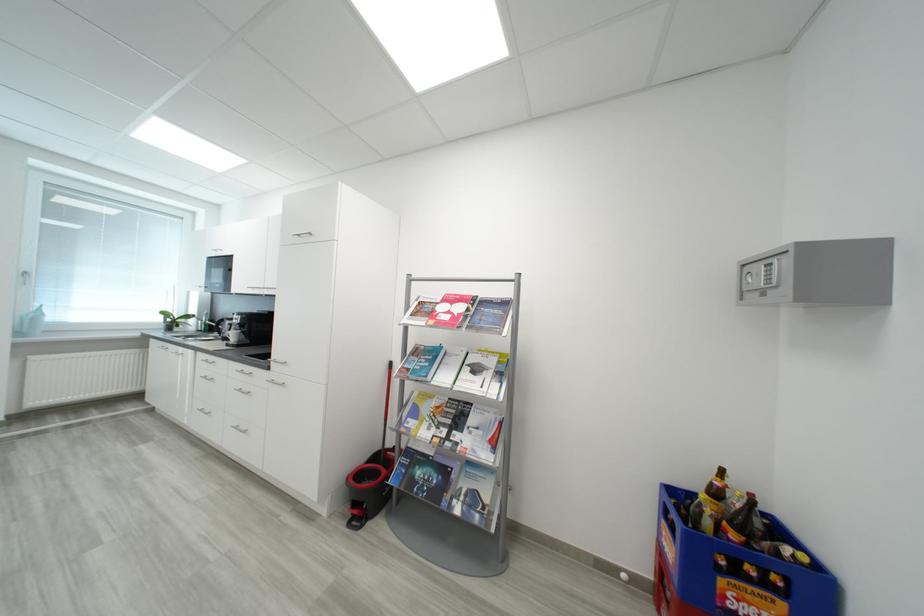
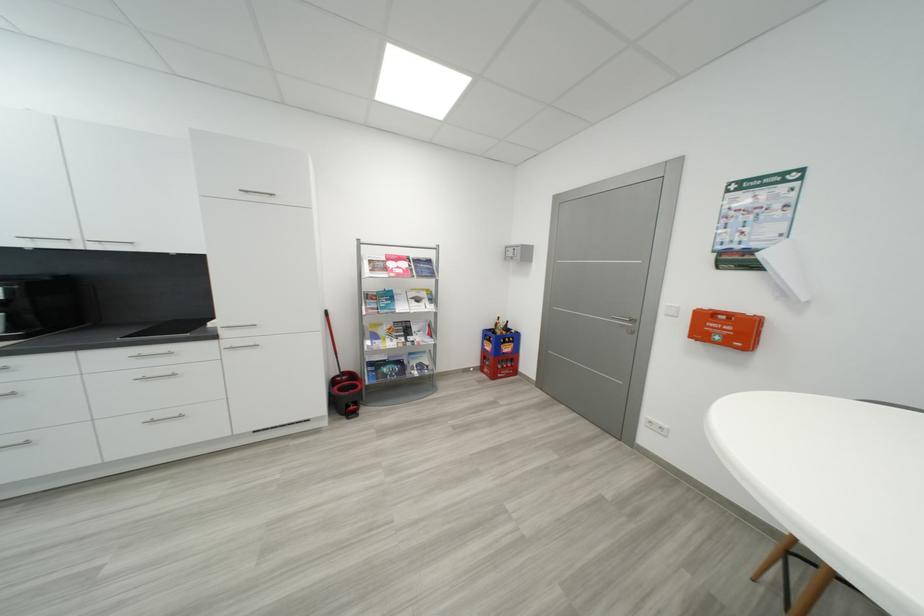
The point at (x=480, y=422) is marked in the first image. Where is the corresponding point in the second image?

(421, 330)